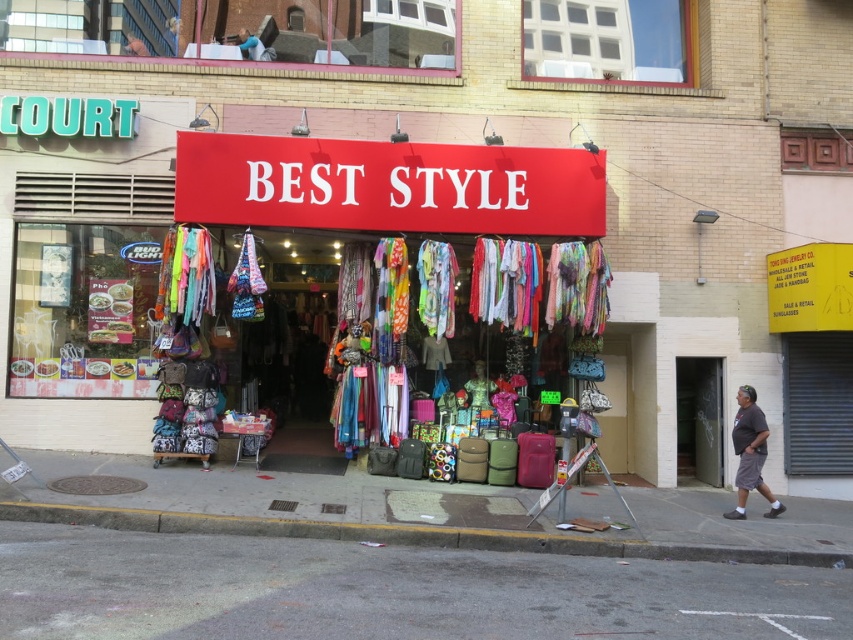
Question: Which of these objects is positioned closest to the gray cotton shorts at lower right?

Choices:
 (A) textile fabric scarves at center
 (B) concrete at lower left

Answer: (B)

Question: Which point is closer to the camera?

Choices:
 (A) textile fabric scarves at center
 (B) concrete at lower left
 (C) gray asphalt at lower center

Answer: (C)

Question: Does gray asphalt at lower center have a smaller size compared to textile fabric scarves at center?

Choices:
 (A) no
 (B) yes

Answer: (B)

Question: Is concrete at lower left wider than gray cotton shorts at lower right?

Choices:
 (A) yes
 (B) no

Answer: (B)

Question: Does textile fabric scarves at center come in front of gray cotton shorts at lower right?

Choices:
 (A) yes
 (B) no

Answer: (B)

Question: Among these objects, which one is farthest from the camera?

Choices:
 (A) gray asphalt at lower center
 (B) gray cotton shorts at lower right
 (C) concrete at lower left
 (D) textile fabric scarves at center

Answer: (D)